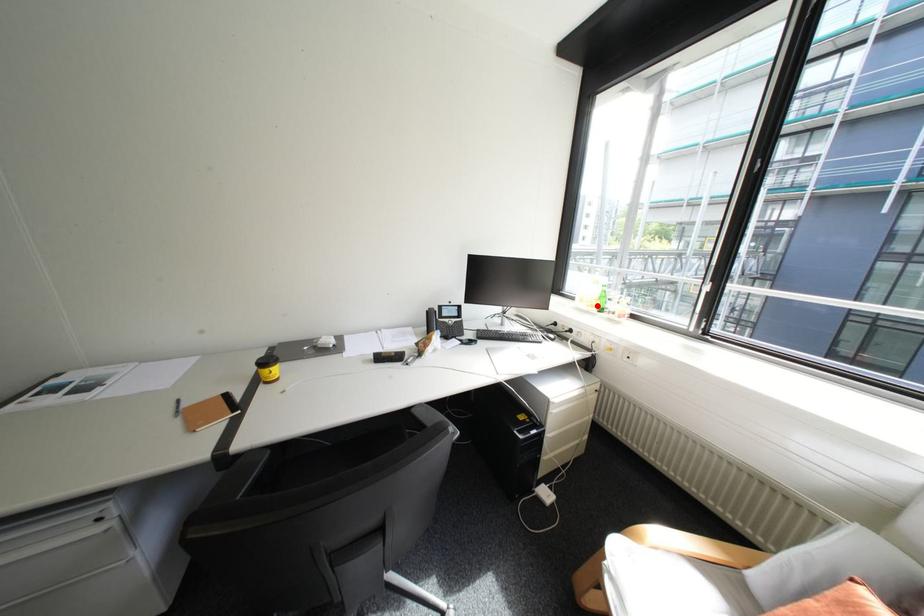
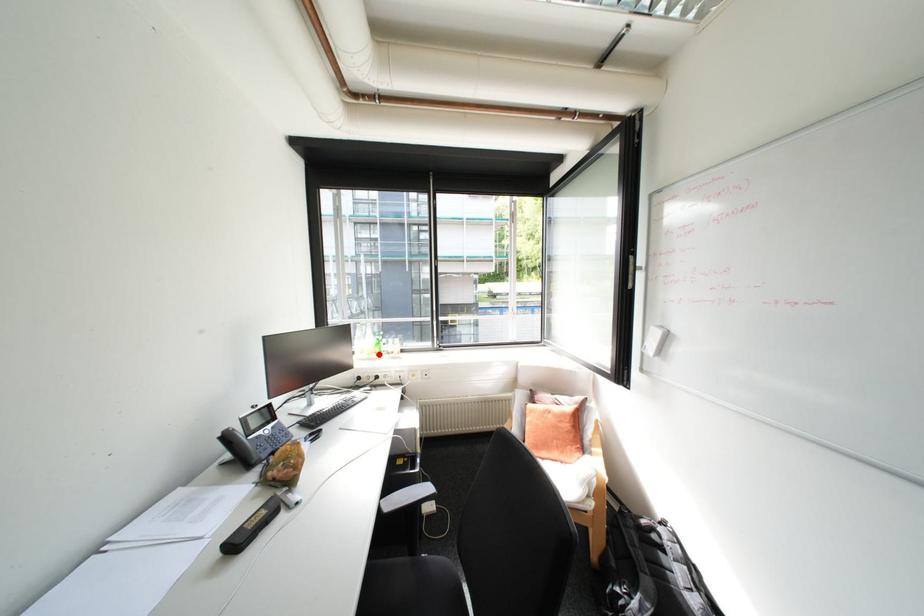
I am providing you with two images of the same scene from different viewpoints. A red point is marked on the first image and another point is marked on the second image. Is the red point in image1 aligned with the point shown in image2?

Yes